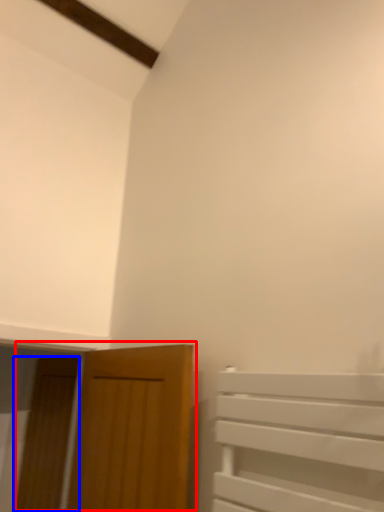
Question: Which of the following is the farthest to the observer, door (highlighted by a red box) or door (highlighted by a blue box)?

Choices:
 (A) door
 (B) door

Answer: (B)